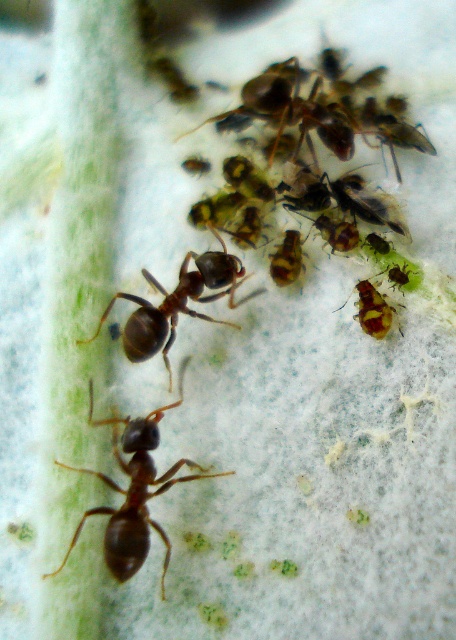
Question: Does brown matte ant at center have a greater width compared to yellow-green glossy ant at center-right?

Choices:
 (A) no
 (B) yes

Answer: (B)

Question: Considering the real-world distances, which object is closest to the yellow-green glossy ant at center-right?

Choices:
 (A) shiny brown ant at center
 (B) brown matte ant at center

Answer: (A)

Question: Which point is farther to the camera?

Choices:
 (A) shiny brown ant at center
 (B) brown matte ant at center

Answer: (A)

Question: Does brown matte ant at center appear on the right side of yellow-green glossy ant at center-right?

Choices:
 (A) no
 (B) yes

Answer: (A)

Question: Which point is farther from the camera taking this photo?

Choices:
 (A) (136, 496)
 (B) (373, 326)
 (C) (224, 266)

Answer: (C)

Question: Can you confirm if shiny brown ant at center is positioned below yellow-green glossy ant at center-right?

Choices:
 (A) no
 (B) yes

Answer: (A)